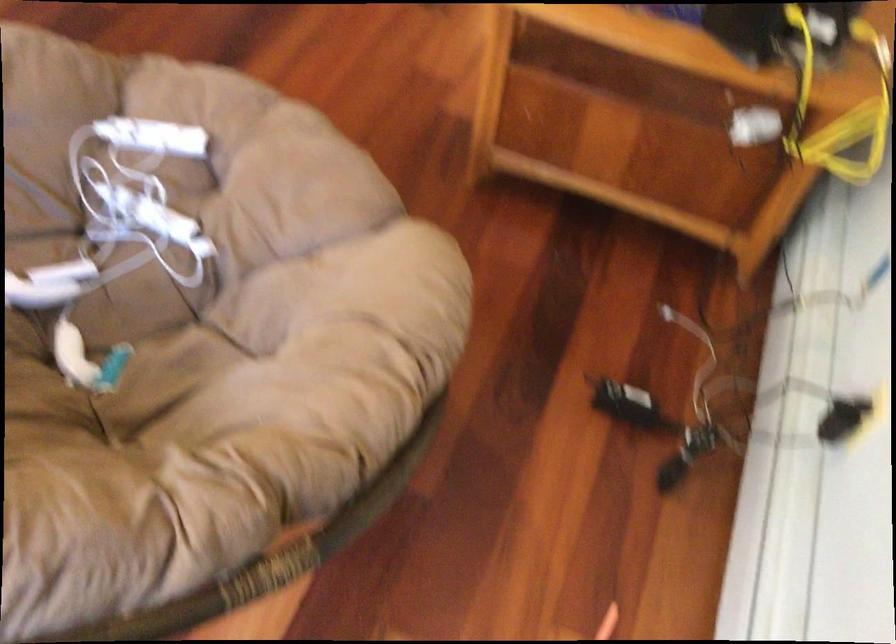
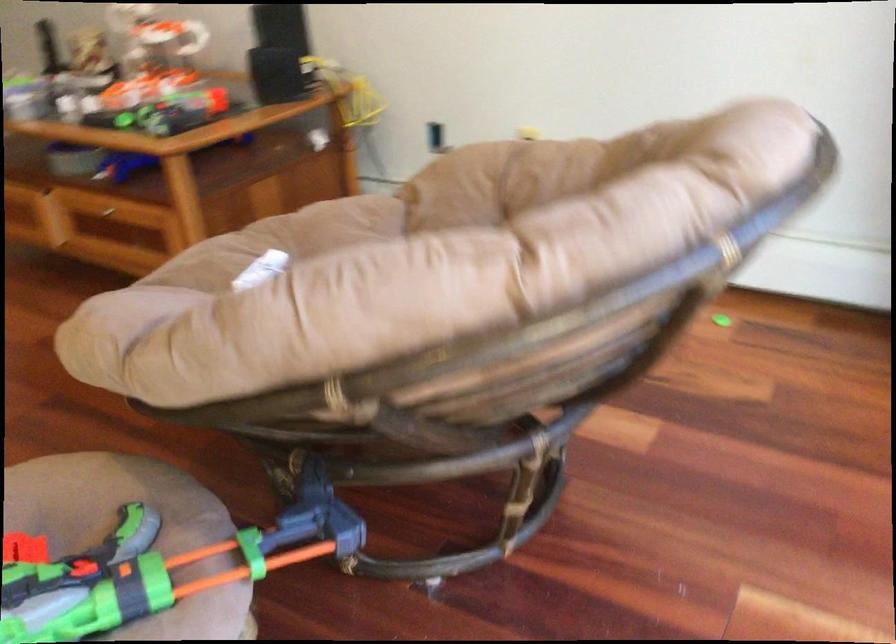
Find the pixel in the second image that matches (x=246, y=147) in the first image.

(281, 241)